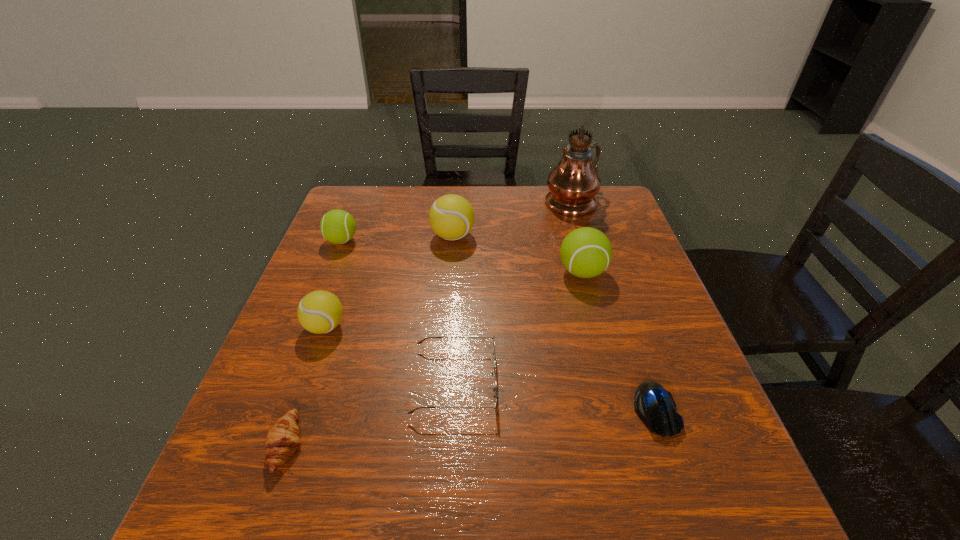
Locate an element on the screen. vacant space positioned 0.180m on the front-facing side of the second shortest object is located at coordinates click(x=410, y=446).

This screenshot has height=540, width=960. I want to click on free space located 0.090m on the button side of the computer mouse, so click(684, 495).

You are a GUI agent. You are given a task and a screenshot of the screen. Output one action in this format:
    pyautogui.click(x=<x>, y=<y>)
    Task: Click on the oil lamp at the far edge
    This screenshot has width=960, height=540.
    Given the screenshot: What is the action you would take?
    pyautogui.click(x=573, y=184)

Identify the location of tennis ball located in the far edge section of the desktop. (451, 217).

I want to click on object that is at the near edge, so tap(282, 440).

The image size is (960, 540). What are the coordinates of `pastry situated at the left edge` in the screenshot? It's located at (282, 440).

This screenshot has height=540, width=960. What are the coordinates of `oil lamp that is at the right edge` in the screenshot? It's located at (573, 184).

Where is `tennis ball present at the right edge`? tennis ball present at the right edge is located at coordinates (586, 252).

Locate an element on the screen. This screenshot has width=960, height=540. computer mouse that is at the right edge is located at coordinates (654, 405).

Locate an element on the screen. The width and height of the screenshot is (960, 540). object that is positioned at the near left corner is located at coordinates (282, 440).